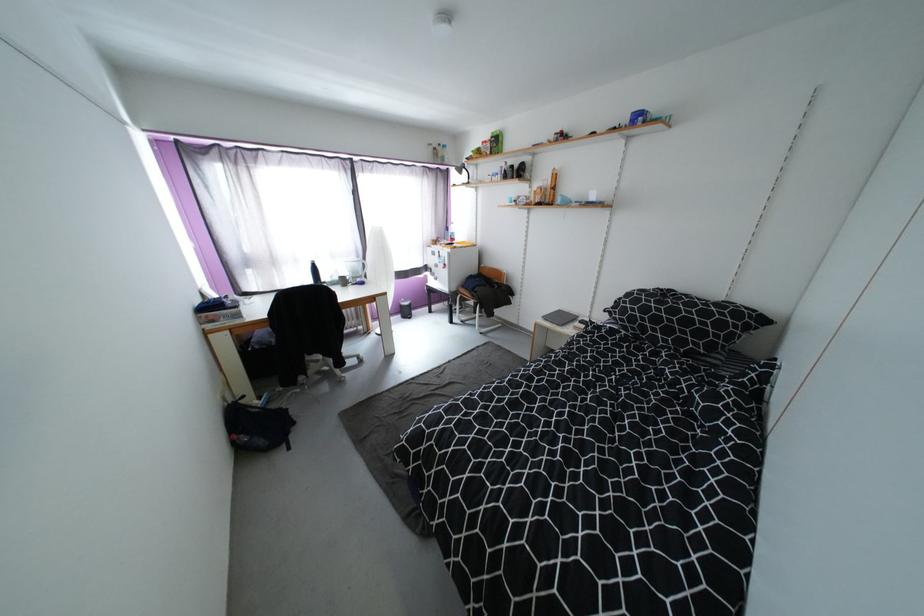
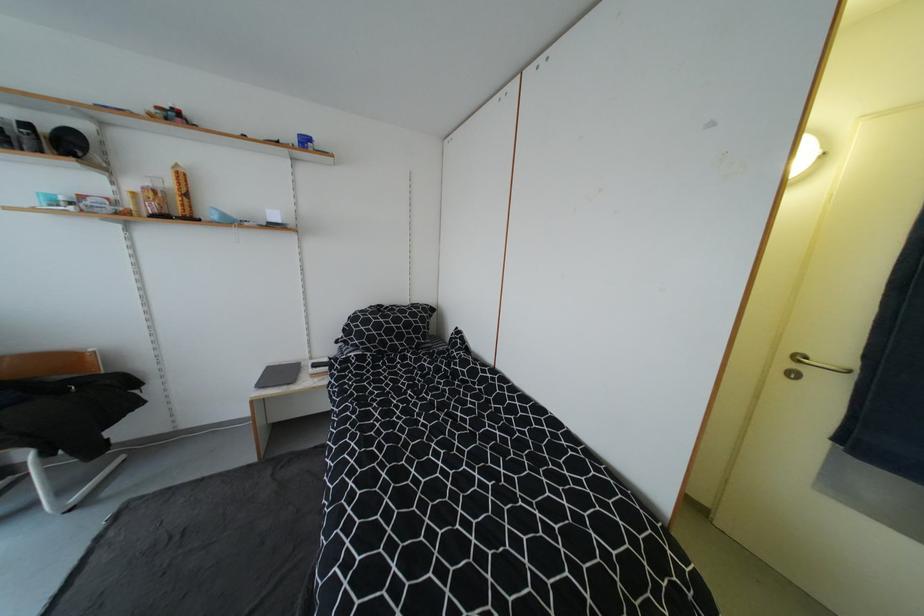
Locate, in the second image, the point that corresponds to pixel 554 184 in the first image.

(176, 185)